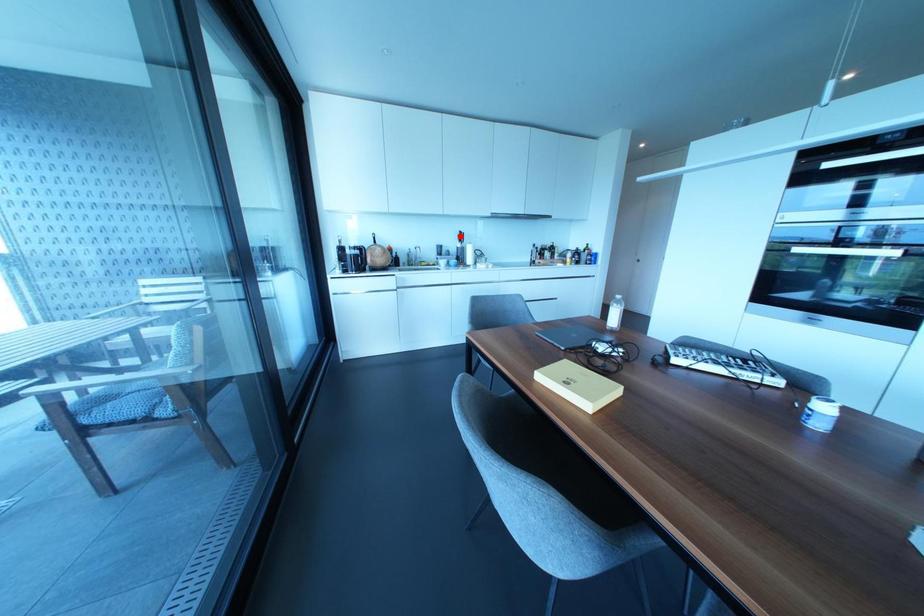
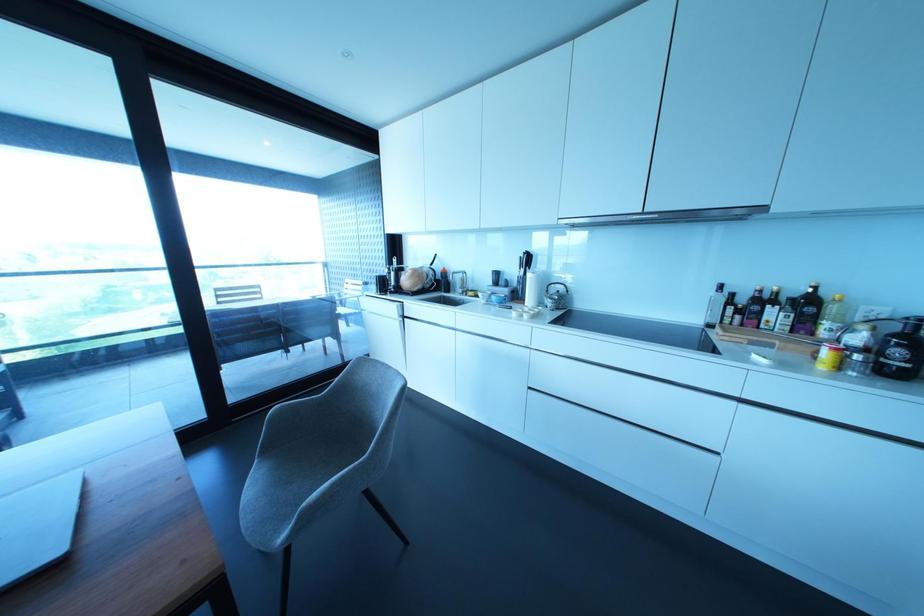
Where in the second image is the point corresponding to the highlighted location from the first image?

(527, 259)